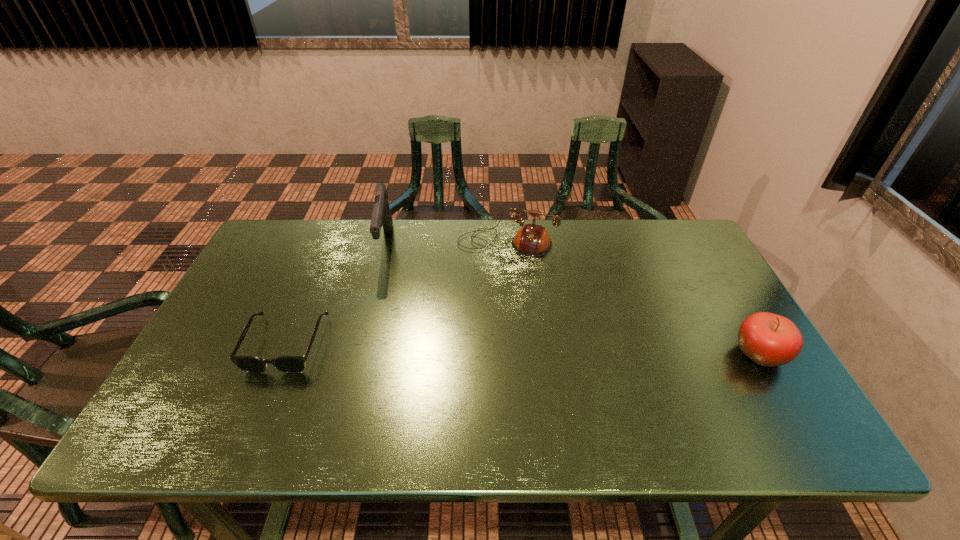
I want to click on free space between the telephone and the leftmost object, so click(x=396, y=294).

At what (x,y) coordinates should I click in order to perform the action: click on empty location between the shortest object and the tallest object. Please return your answer as a coordinate pair (x, y). This screenshot has width=960, height=540. Looking at the image, I should click on (336, 294).

Where is `free space between the apple and the shortest object`? free space between the apple and the shortest object is located at coordinates (523, 349).

I want to click on free point between the rightmost object and the telephone, so click(634, 300).

Identify the location of vacant area that lies between the shortest object and the tallest object. (336, 294).

Find the location of `vacant area that lies between the sunglasses and the tallest object`. vacant area that lies between the sunglasses and the tallest object is located at coordinates (336, 294).

Find the location of a particular element. Image resolution: width=960 pixels, height=540 pixels. object that is the second closest to the gun is located at coordinates (533, 240).

Identify which object is the nearest to the leftmost object. Please provide its 2D coordinates. Your answer should be formatted as a tuple, i.e. [(x, y)], where the tuple contains the x and y coordinates of a point satisfying the conditions above.

[(381, 216)]

This screenshot has width=960, height=540. In order to click on vacant region that satisfies the following two spatial constraints: 1. on the front side of the tallest object; 2. on the left side of the rightmost object in this screenshot , I will do `click(358, 354)`.

Where is `free location that satisfies the following two spatial constraints: 1. on the front side of the apple; 2. on the right side of the tallest object`? The height and width of the screenshot is (540, 960). free location that satisfies the following two spatial constraints: 1. on the front side of the apple; 2. on the right side of the tallest object is located at coordinates (358, 354).